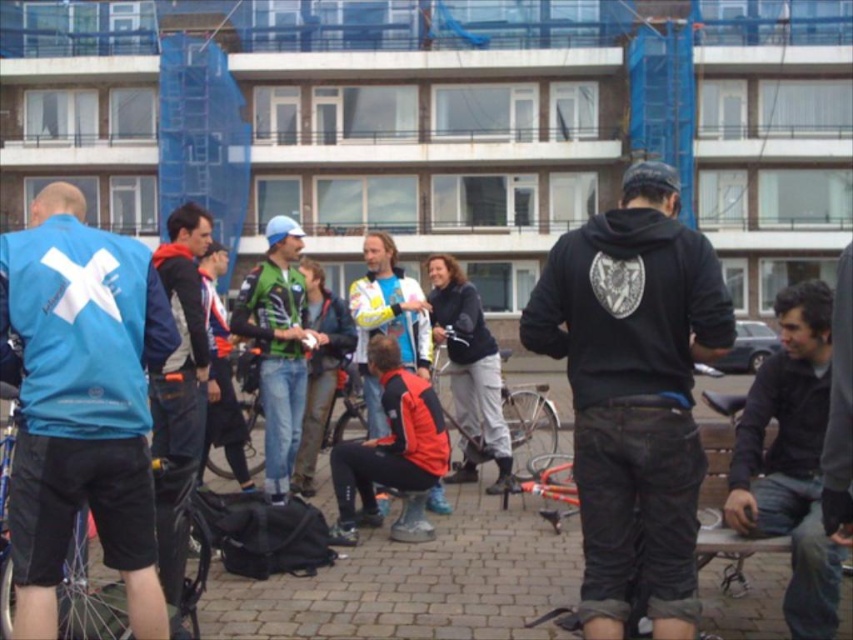
You are a photographer trying to capture a group photo of the green fabric jacket at center and the matte yellow helmet at center. Since you want to ensure both subjects are in focus, you need to know their height relationship. Which one is taller?

The green fabric jacket at center is taller than the matte yellow helmet at center.

You are a photographer trying to capture a shot of the matte blue jacket at left and the matte yellow helmet at center. Based on their positions, which object is closer to the camera?

The matte blue jacket at left is positioned under the matte yellow helmet at center, meaning it is closer to the camera.

You are a photographer trying to capture a group photo of the matte blue jacket at left and the matte yellow helmet at center. Since you want to ensure both subjects are in focus, you need to know which one is closer to the camera. Can you determine which is nearer?

The matte blue jacket at left has a smaller size compared to the matte yellow helmet at center, which suggests it is farther away from the camera. Therefore, the matte yellow helmet at center is closer to the camera.